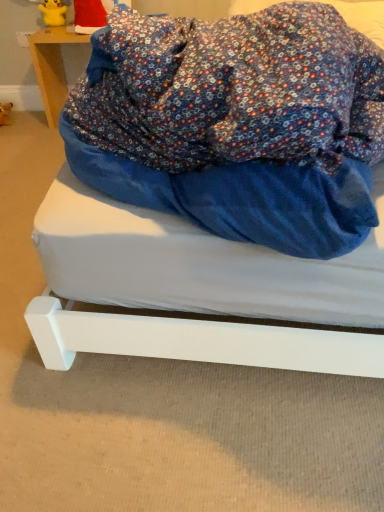
What is the approximate height of yellow rubber figurine at upper left?

The height of yellow rubber figurine at upper left is 22.12 centimeters.

Find the location of `white matte bed at center`. white matte bed at center is located at coordinates (197, 290).

Locate an element on the screen. The height and width of the screenshot is (512, 384). yellow rubber figurine at upper left is located at coordinates (53, 12).

Considering the relative positions of yellow rubber figurine at upper left and wooden table at upper left in the image provided, is yellow rubber figurine at upper left to the right of wooden table at upper left from the viewer's perspective?

Incorrect, yellow rubber figurine at upper left is not on the right side of wooden table at upper left.

From a real-world perspective, which is physically below, yellow rubber figurine at upper left or wooden table at upper left?

wooden table at upper left.

From the image's perspective, does yellow rubber figurine at upper left appear lower than wooden table at upper left?

No.

You are a GUI agent. You are given a task and a screenshot of the screen. Output one action in this format:
    pyautogui.click(x=<x>, y=<y>)
    Task: Click on the bed below the santa hat at upper left (from the image's perspective)
    This screenshot has width=384, height=512.
    Given the screenshot: What is the action you would take?
    pyautogui.click(x=197, y=290)

Is santa hat at upper left shorter than white matte bed at center?

No.

Looking at this image, can you tell me how much santa hat at upper left and white matte bed at center differ in facing direction?

2.11 degrees separate the facing orientations of santa hat at upper left and white matte bed at center.

Based on the photo, is santa hat at upper left surrounding wooden table at upper left?

No, wooden table at upper left is not inside santa hat at upper left.

Identify the location of furniture on the left of santa hat at upper left. The image size is (384, 512). (52, 67).

Considering the relative positions of santa hat at upper left and wooden table at upper left in the image provided, is santa hat at upper left to the left of wooden table at upper left from the viewer's perspective?

No.

In terms of size, does santa hat at upper left appear bigger or smaller than wooden table at upper left?

Clearly, santa hat at upper left is smaller in size than wooden table at upper left.

How different are the orientations of wooden table at upper left and yellow rubber figurine at upper left in degrees?

The angular difference between wooden table at upper left and yellow rubber figurine at upper left is 3.13 degrees.

Could you tell me if wooden table at upper left is facing yellow rubber figurine at upper left?

No, wooden table at upper left is not facing towards yellow rubber figurine at upper left.

Is wooden table at upper left placed right next to yellow rubber figurine at upper left?

No, wooden table at upper left is not touching yellow rubber figurine at upper left.

Is the position of wooden table at upper left more distant than that of yellow rubber figurine at upper left?

No, wooden table at upper left is in front of yellow rubber figurine at upper left.

Can you confirm if white matte bed at center is taller than yellow rubber figurine at upper left?

In fact, white matte bed at center may be shorter than yellow rubber figurine at upper left.

From a real-world perspective, is white matte bed at center physically below yellow rubber figurine at upper left?

Correct, in the physical world, white matte bed at center is lower than yellow rubber figurine at upper left.

Which object is further away from the camera taking this photo, white matte bed at center or yellow rubber figurine at upper left?

yellow rubber figurine at upper left is more distant.

From the image's perspective, does white matte bed at center appear lower than yellow rubber figurine at upper left?

Correct, white matte bed at center appears lower than yellow rubber figurine at upper left in the image.

Is santa hat at upper left oriented towards yellow rubber figurine at upper left?

No, santa hat at upper left is not facing towards yellow rubber figurine at upper left.

Measure the distance between santa hat at upper left and yellow rubber figurine at upper left.

santa hat at upper left and yellow rubber figurine at upper left are 7.59 inches apart from each other.

Is santa hat at upper left bigger or smaller than yellow rubber figurine at upper left?

santa hat at upper left is bigger than yellow rubber figurine at upper left.

Does point (82, 14) lie in front of point (57, 4)?

Yes, it is in front of point (57, 4).

Measure the distance from white matte bed at center to wooden table at upper left.

The distance of white matte bed at center from wooden table at upper left is 1.70 meters.

Where is `furniture positioned vertically above the white matte bed at center (from a real-world perspective)`? The image size is (384, 512). furniture positioned vertically above the white matte bed at center (from a real-world perspective) is located at coordinates (52, 67).

From the image's perspective, which one is positioned higher, white matte bed at center or wooden table at upper left?

wooden table at upper left.

From a real-world perspective, is white matte bed at center on top of wooden table at upper left?

No, from a real-world perspective, white matte bed at center is not over wooden table at upper left

Identify the location of furniture below the yellow rubber figurine at upper left (from a real-world perspective). This screenshot has height=512, width=384. (52, 67).

Image resolution: width=384 pixels, height=512 pixels. I want to click on toy behind the white matte bed at center, so click(90, 15).

Which object lies nearer to the anchor point yellow rubber figurine at upper left, white matte bed at center or santa hat at upper left?

Based on the image, santa hat at upper left appears to be nearer to yellow rubber figurine at upper left.

Looking at the image, which one is located closer to white matte bed at center, santa hat at upper left or yellow rubber figurine at upper left?

santa hat at upper left is positioned closer to the anchor white matte bed at center.

Which object lies further to the anchor point wooden table at upper left, white matte bed at center or yellow rubber figurine at upper left?

The object further to wooden table at upper left is white matte bed at center.

From the picture: When comparing their distances from santa hat at upper left, does wooden table at upper left or white matte bed at center seem closer?

wooden table at upper left lies closer to santa hat at upper left than the other object.

Which object lies nearer to the anchor point white matte bed at center, wooden table at upper left or yellow rubber figurine at upper left?

Among the two, wooden table at upper left is located nearer to white matte bed at center.

From the image, which object appears to be farther from santa hat at upper left, yellow rubber figurine at upper left or wooden table at upper left?

Based on the image, wooden table at upper left appears to be further to santa hat at upper left.

Which object lies nearer to the anchor point yellow rubber figurine at upper left, santa hat at upper left or wooden table at upper left?

The object closer to yellow rubber figurine at upper left is santa hat at upper left.

Which object lies nearer to the anchor point santa hat at upper left, wooden table at upper left or yellow rubber figurine at upper left?

Among the two, yellow rubber figurine at upper left is located nearer to santa hat at upper left.

This screenshot has height=512, width=384. I want to click on toy positioned between white matte bed at center and yellow rubber figurine at upper left from near to far, so click(90, 15).

At what (x,y) coordinates should I click in order to perform the action: click on furniture between white matte bed at center and yellow rubber figurine at upper left from front to back. Please return your answer as a coordinate pair (x, y). Looking at the image, I should click on point(52,67).

Where is `toy located between white matte bed at center and wooden table at upper left in the depth direction`? The image size is (384, 512). toy located between white matte bed at center and wooden table at upper left in the depth direction is located at coordinates pos(90,15).

This screenshot has height=512, width=384. What are the coordinates of `toy between yellow rubber figurine at upper left and wooden table at upper left from top to bottom` in the screenshot? It's located at (90, 15).